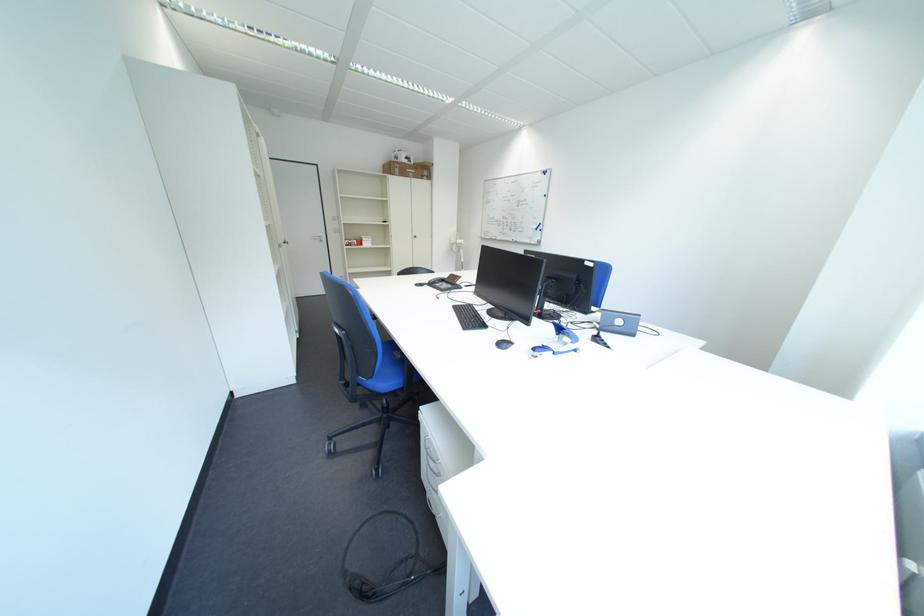
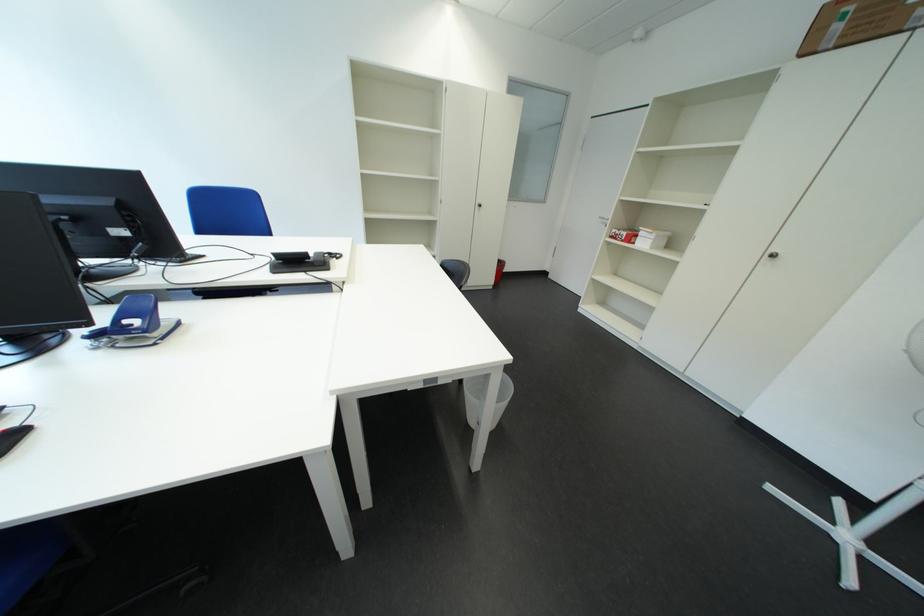
Find the pixel in the second image that matches pixel 380 246 in the first image.

(657, 246)